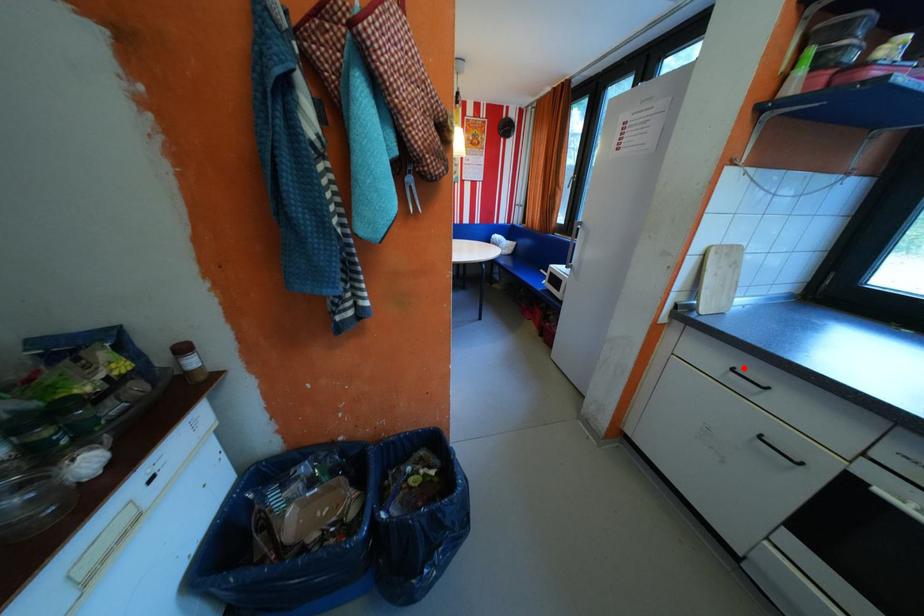
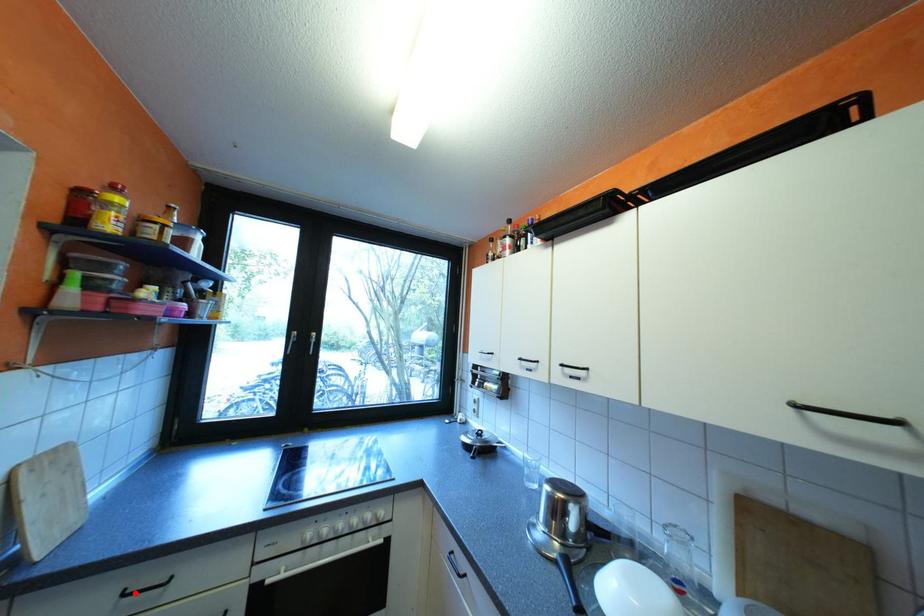
I am providing you with two images of the same scene from different viewpoints. A red point is marked on the first image and another point is marked on the second image. Is the red point in image1 aligned with the point shown in image2?

Yes